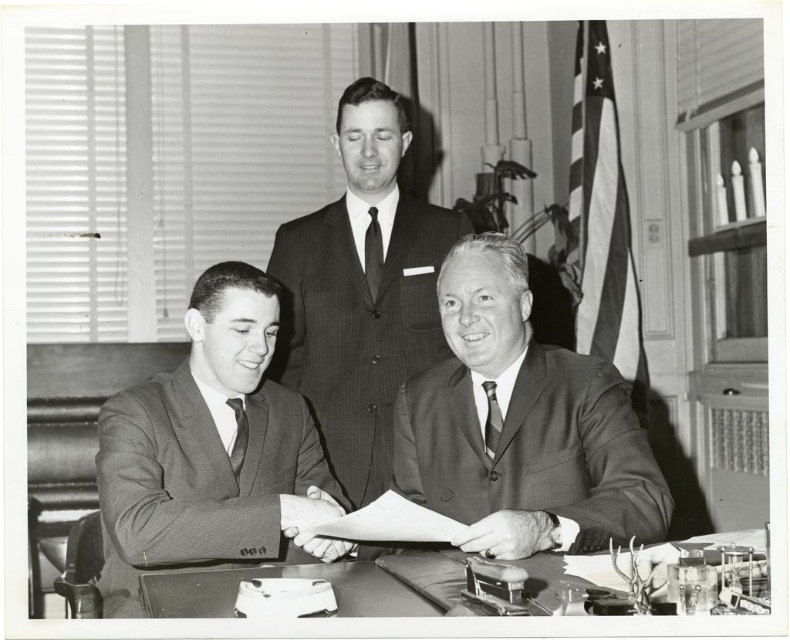
Question: Among these points, which one is farthest from the camera?

Choices:
 (A) (145, 593)
 (B) (375, 276)

Answer: (B)

Question: Which of the following is the closest to the observer?

Choices:
 (A) smooth suit at center
 (B) matte black tie at left
 (C) dark gray textured tie at center
 (D) smooth brown suit at center

Answer: (D)

Question: Can you confirm if glossy wooden table at center is positioned to the right of matte black tie at left?

Choices:
 (A) yes
 (B) no

Answer: (A)

Question: Estimate the real-world distances between objects in this image. Which object is closer to the glossy wooden table at center?

Choices:
 (A) matte black tie at left
 (B) smooth brown suit at center
 (C) smooth suit at center

Answer: (B)

Question: Is checkered fabric suit at lower left wider than black silk tie at center?

Choices:
 (A) yes
 (B) no

Answer: (A)

Question: Is smooth brown suit at center smaller than black silk tie at center?

Choices:
 (A) yes
 (B) no

Answer: (B)